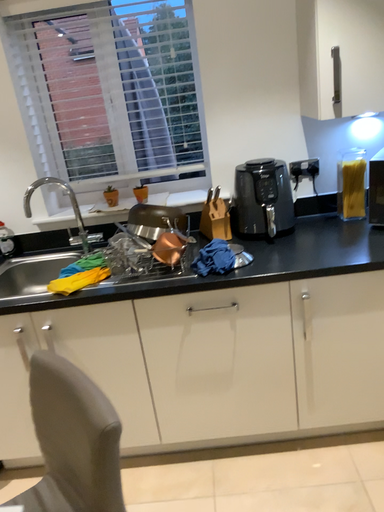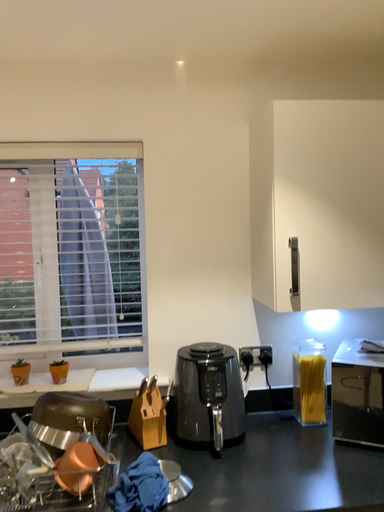
Question: Which way did the camera rotate in the video?

Choices:
 (A) rotated upward
 (B) rotated downward

Answer: (A)